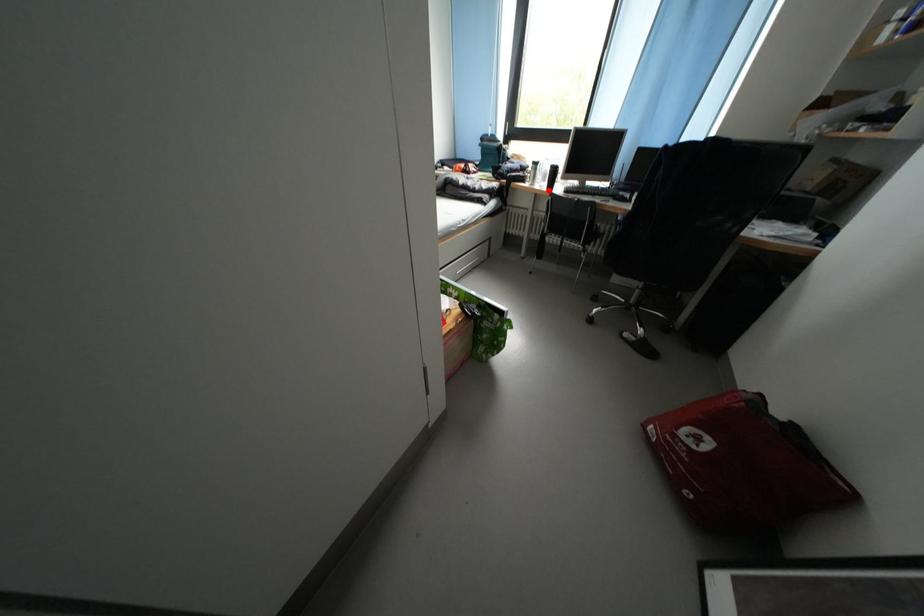
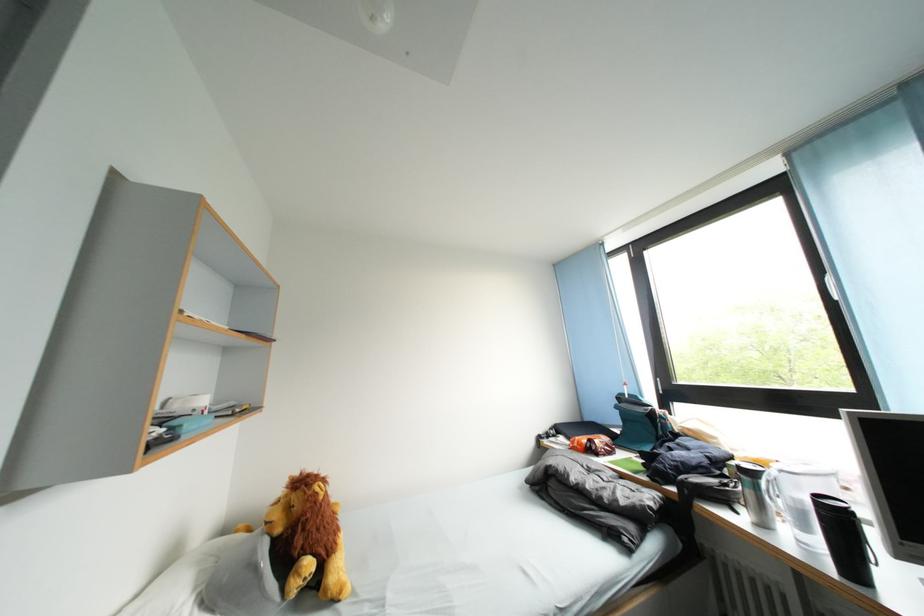
Question: I am providing you with two images of the same scene from different viewpoints. Image1 has a red point marked. In image2, the corresponding 3D location appears at what relative position? Reply with the corresponding letter.

Choices:
 (A) Closer
 (B) Farther

Answer: (B)